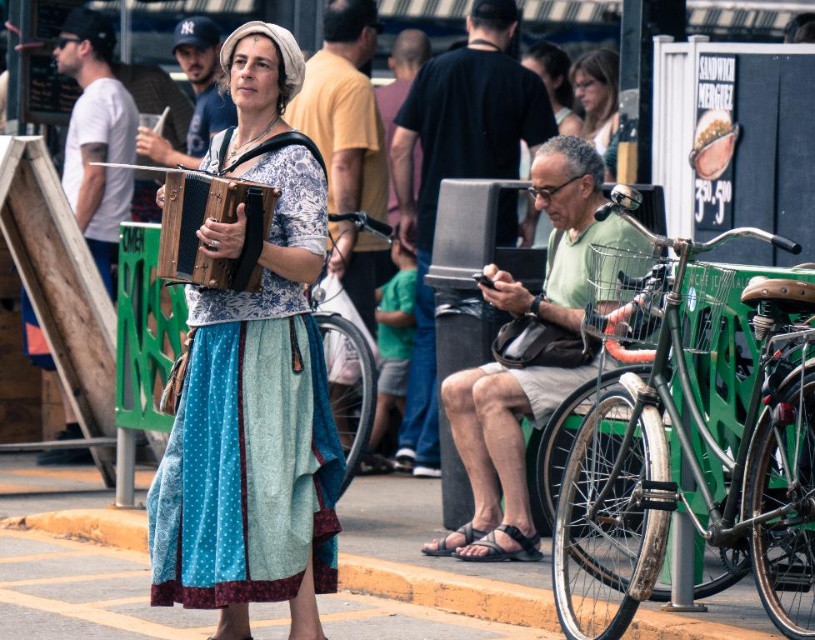
Can you confirm if green matte shirt at center is positioned below silver metallic bicycle at center?

Incorrect, green matte shirt at center is not positioned below silver metallic bicycle at center.

Who is more distant from viewer, (479, 428) or (359, 225)?

The point (359, 225) is behind.

You are a GUI agent. You are given a task and a screenshot of the screen. Output one action in this format:
    pyautogui.click(x=<x>, y=<y>)
    Task: Click on the green matte shirt at center
    The height and width of the screenshot is (640, 815).
    Given the screenshot: What is the action you would take?
    pyautogui.click(x=499, y=452)

Who is shorter, shiny silver bicycle at right or green matte shirt at center?

With less height is shiny silver bicycle at right.

This screenshot has width=815, height=640. What do you see at coordinates (672, 426) in the screenshot?
I see `shiny silver bicycle at right` at bounding box center [672, 426].

Who is more distant from viewer, [664,454] or [496,417]?

Point [496,417]

The height and width of the screenshot is (640, 815). I want to click on shiny silver bicycle at right, so [x=672, y=426].

Is point (611, 396) positioned in front of point (344, 314)?

Yes, point (611, 396) is in front of point (344, 314).

Does shiny silver bicycle at right appear on the left side of silver metallic bicycle at center?

In fact, shiny silver bicycle at right is to the right of silver metallic bicycle at center.

Does point (667, 460) lie behind point (351, 308)?

No, (667, 460) is closer to viewer.

The width and height of the screenshot is (815, 640). I want to click on shiny silver bicycle at right, so click(x=672, y=426).